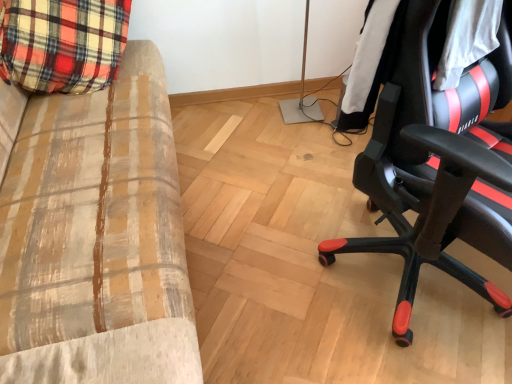
Question: Is plaid fabric couch at left closer to camera compared to black leather jacket at right?

Choices:
 (A) yes
 (B) no

Answer: (A)

Question: Could you tell me if plaid fabric couch at left is turned towards black leather jacket at right?

Choices:
 (A) yes
 (B) no

Answer: (A)

Question: From the image's perspective, is plaid fabric couch at left above black leather jacket at right?

Choices:
 (A) yes
 (B) no

Answer: (B)

Question: Is black leather jacket at right completely or partially inside plaid fabric couch at left?

Choices:
 (A) yes
 (B) no

Answer: (B)

Question: Does plaid fabric couch at left have a greater height compared to black leather jacket at right?

Choices:
 (A) yes
 (B) no

Answer: (A)

Question: From the image's perspective, is plaid fabric couch at left under black leather jacket at right?

Choices:
 (A) no
 (B) yes

Answer: (B)

Question: Is black leather chair at right shorter than black leather jacket at right?

Choices:
 (A) no
 (B) yes

Answer: (A)

Question: Does black leather chair at right have a greater width compared to black leather jacket at right?

Choices:
 (A) yes
 (B) no

Answer: (A)

Question: Considering the relative sizes of black leather chair at right and black leather jacket at right in the image provided, is black leather chair at right taller than black leather jacket at right?

Choices:
 (A) yes
 (B) no

Answer: (A)

Question: Is black leather chair at right closer to the viewer compared to black leather jacket at right?

Choices:
 (A) no
 (B) yes

Answer: (B)

Question: Is black leather chair at right to the left of black leather jacket at right from the viewer's perspective?

Choices:
 (A) yes
 (B) no

Answer: (B)

Question: Is black leather chair at right positioned with its back to black leather jacket at right?

Choices:
 (A) yes
 (B) no

Answer: (A)

Question: Could you tell me if plaid fabric couch at left is turned towards black leather chair at right?

Choices:
 (A) yes
 (B) no

Answer: (A)